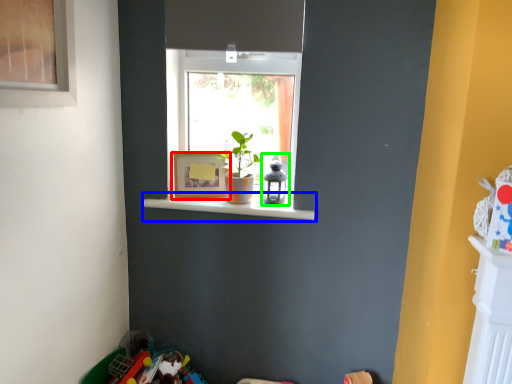
Question: Estimate the real-world distances between objects in this image. Which object is farther from picture frame (highlighted by a red box), window sill (highlighted by a blue box) or toy (highlighted by a green box)?

Choices:
 (A) window sill
 (B) toy

Answer: (B)